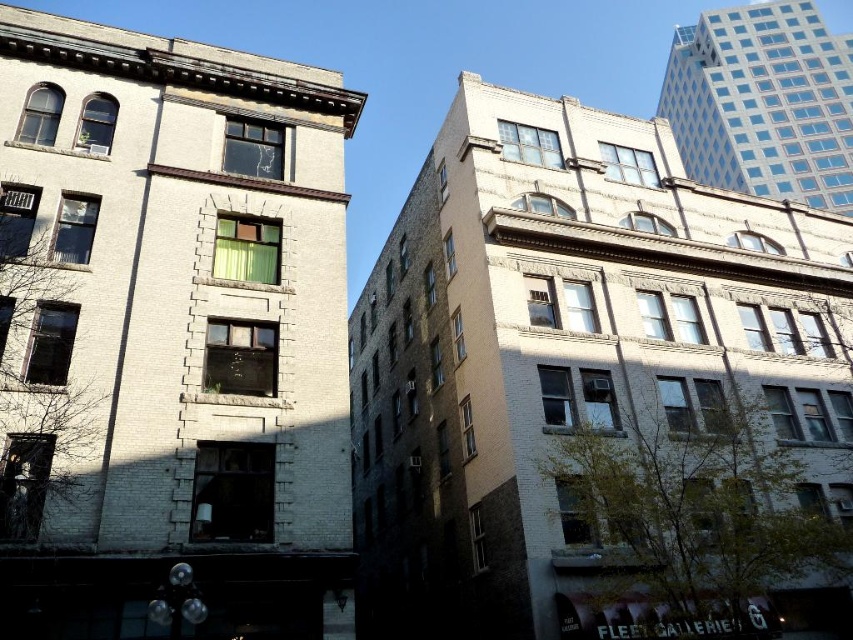
Between white brick building at left and white brick building at center, which one has less height?

Standing shorter between the two is white brick building at left.

Is point (12, 464) farther from viewer compared to point (537, 358)?

No, (12, 464) is in front of (537, 358).

At what (x,y) coordinates should I click in order to perform the action: click on white brick building at left. Please return your answer as a coordinate pair (x, y). Looking at the image, I should click on (170, 336).